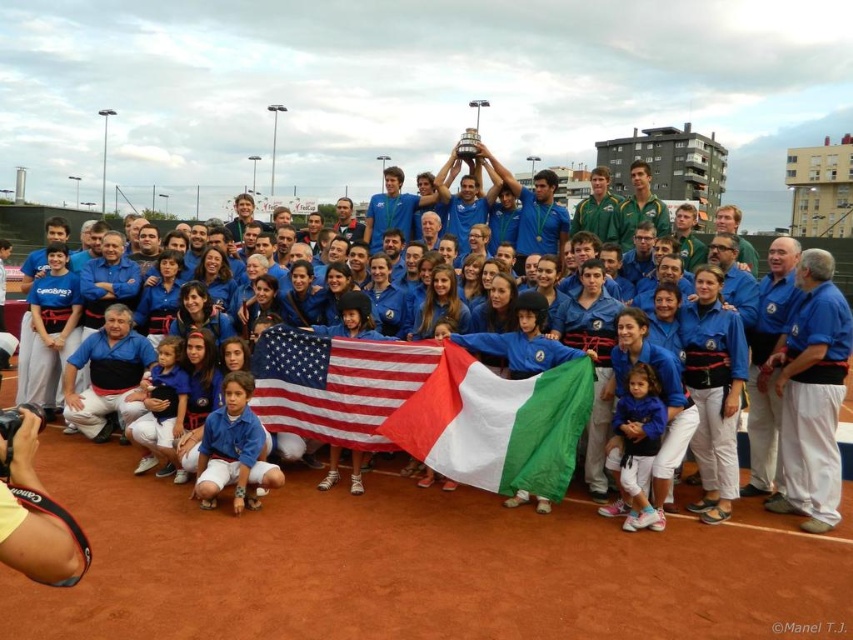
You are a photographer standing at the edge of the tennis court. You need to take a photo that includes both the american flag at center and the blue fabric shirt at lower left. What is the minimum distance you need to move backward to ensure both objects are in frame?

The american flag at center is 8.70 meters away from blue fabric shirt at lower left. To include both in the frame, you need to move back at least 8.70 meters from the closest object, which is the blue fabric shirt at lower left. However, this calculation assumes a straight line and may vary based on camera lens and field of view.

You are standing on the tennis court and see a point marked at coordinate (515,410). If you want to walk directly to that point, how far will you have to walk?

The point at coordinate (515,410) is 35.93 meters away from you, so you will have to walk 35.93 meters to reach it.